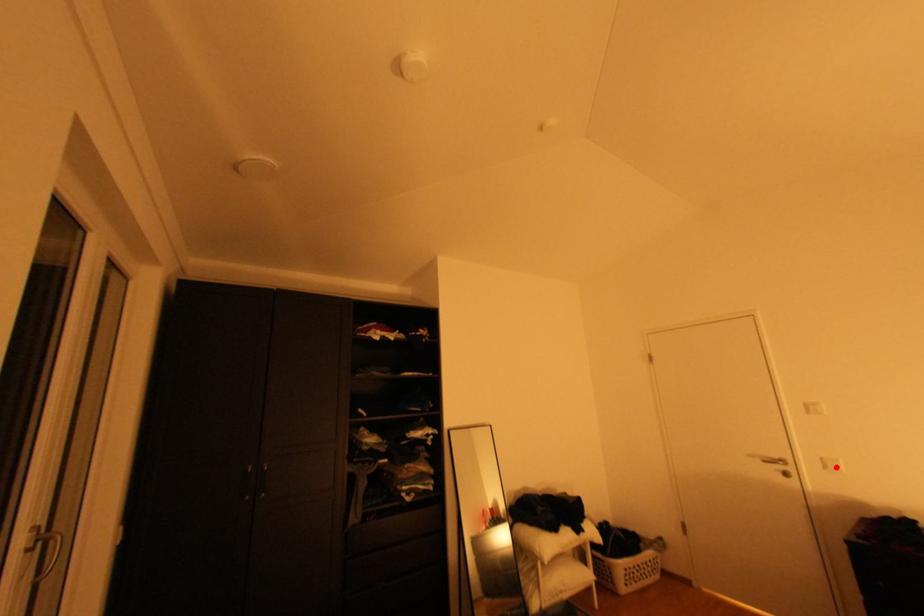
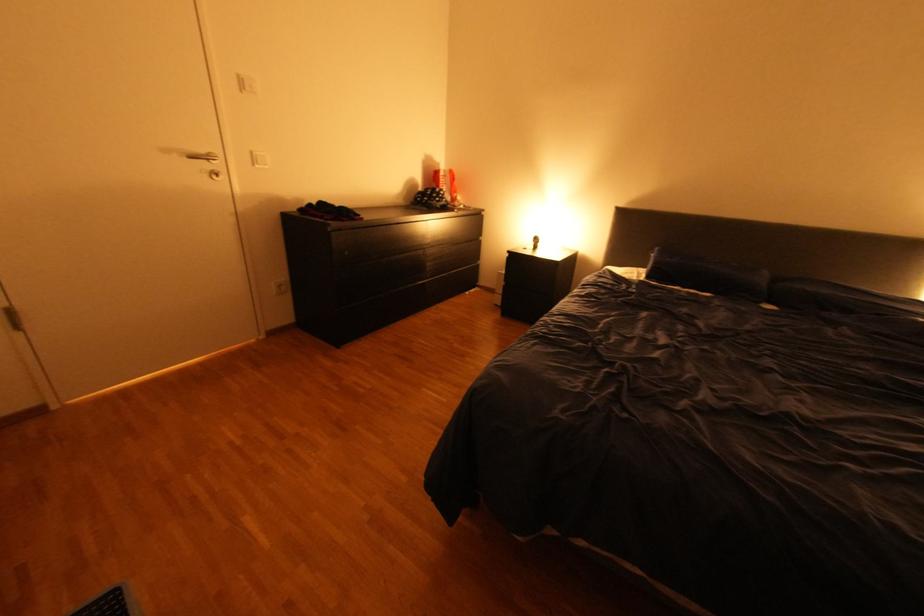
In the second image, find the point that corresponds to the highlighted location in the first image.

(264, 161)